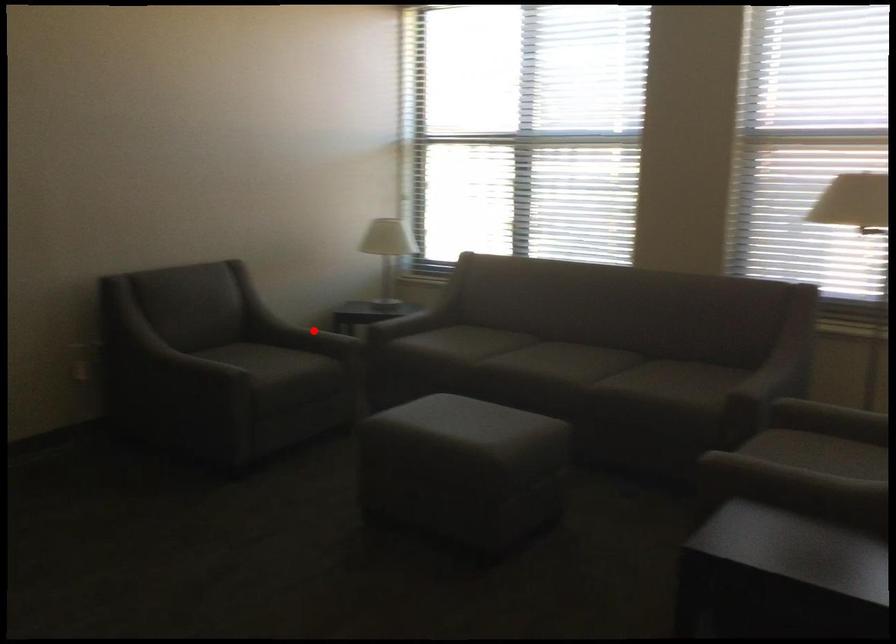
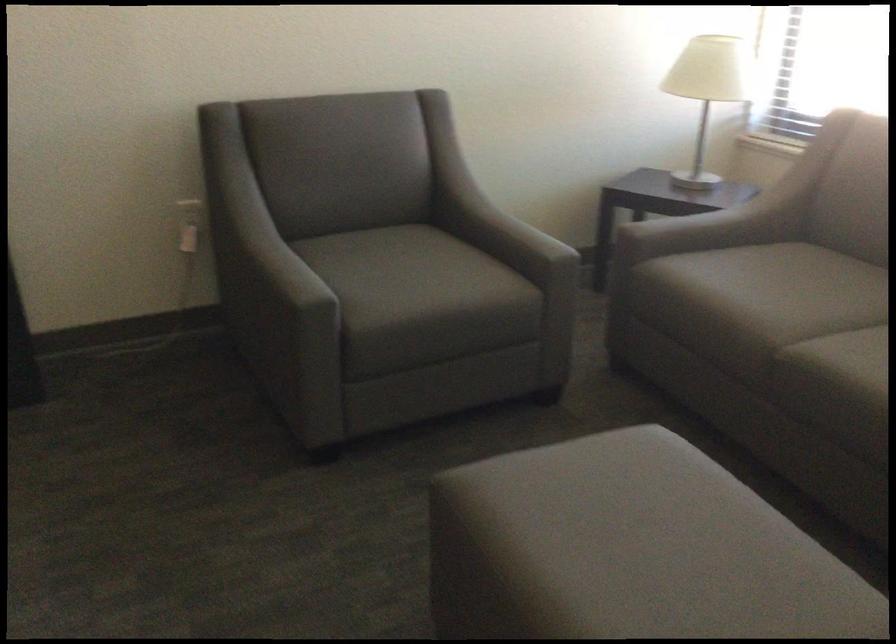
Where in the second image is the point corresponding to the highlighted location from the first image?

(509, 234)